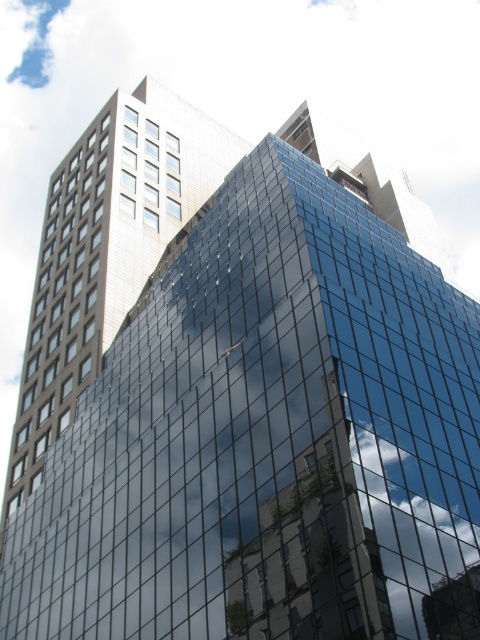
Is clear glass windows at left wider than white glass windows at upper left?

Indeed, clear glass windows at left has a greater width compared to white glass windows at upper left.

Is clear glass windows at left smaller than white glass windows at upper left?

No.

Image resolution: width=480 pixels, height=640 pixels. Identify the location of clear glass windows at left. (64, 301).